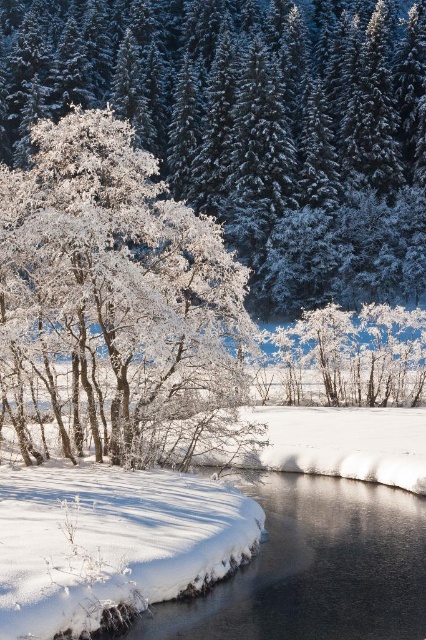
You are an observer standing in the snowy forest. You notice two trees, the white frosty tree at upper left and the frosted white tree at center. Which tree appears taller in the scene?

The white frosty tree at upper left is taller than the frosted white tree at center.

You are an artist trying to capture the winter scene. You notice the white frosty tree at upper left and the frosted white tree at center. Which tree should you focus on if you want to depict a larger tree in your painting?

The white frosty tree at upper left is larger in size than the frosted white tree at center, so you should focus on the white frosty tree at upper left to depict a larger tree in your painting.

You are an observer standing at the edge of the snowy forest. You notice a white frosty tree at upper left and a frosted white tree at center. Which tree is located higher in the image?

The white frosty tree at upper left is positioned over the frosted white tree at center, so it is higher in the image.